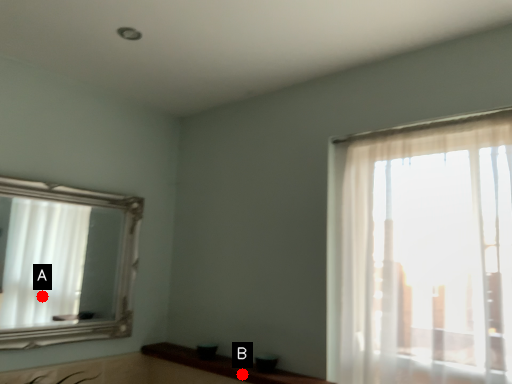
Question: Two points are circled on the image, labeled by A and B beside each circle. Which of the following is the farthest from the observer?

Choices:
 (A) A is further
 (B) B is further

Answer: (A)